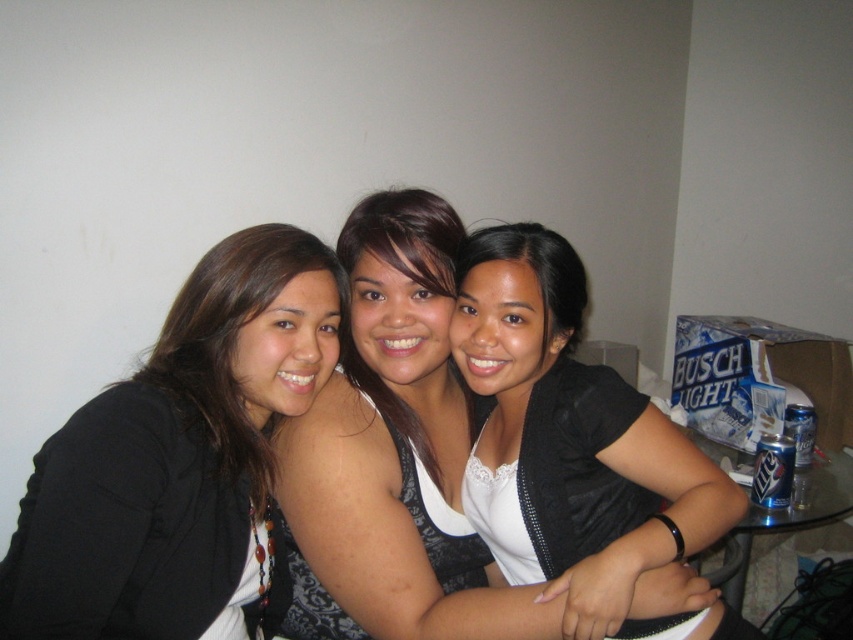
Question: Is matte black jacket at center to the left of black matte jacket at center from the viewer's perspective?

Choices:
 (A) yes
 (B) no

Answer: (A)

Question: Which point is closer to the camera?

Choices:
 (A) (329, 328)
 (B) (491, 468)

Answer: (A)

Question: In this image, where is matte black jacket at center located relative to black matte jacket at center?

Choices:
 (A) right
 (B) left

Answer: (B)

Question: Which point is farther from the camera taking this photo?

Choices:
 (A) (592, 490)
 (B) (325, 294)

Answer: (B)

Question: Is matte black jacket at center bigger than black matte jacket at center?

Choices:
 (A) yes
 (B) no

Answer: (B)

Question: Which object is closer to the camera taking this photo?

Choices:
 (A) black matte jacket at center
 (B) matte black jacket at center

Answer: (B)